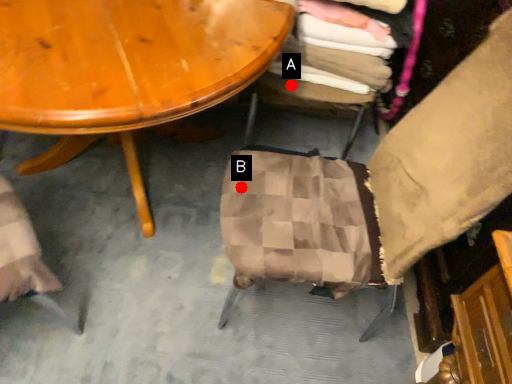
Question: Two points are circled on the image, labeled by A and B beside each circle. Which point is closer to the camera?

Choices:
 (A) A is closer
 (B) B is closer

Answer: (B)